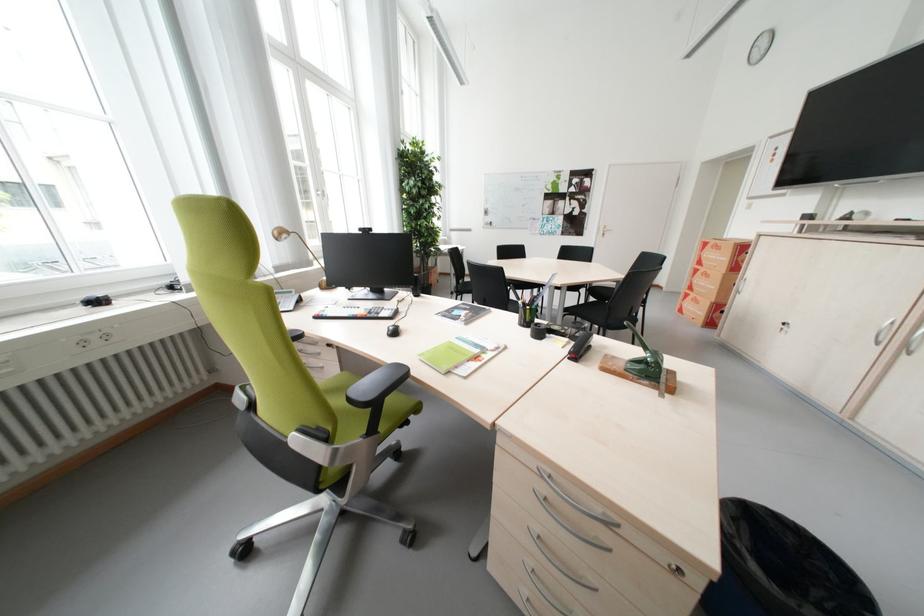
Find where to insert the cabinet keyhole. Please return your answer as a coordinate pair (x, y).

(82, 342)